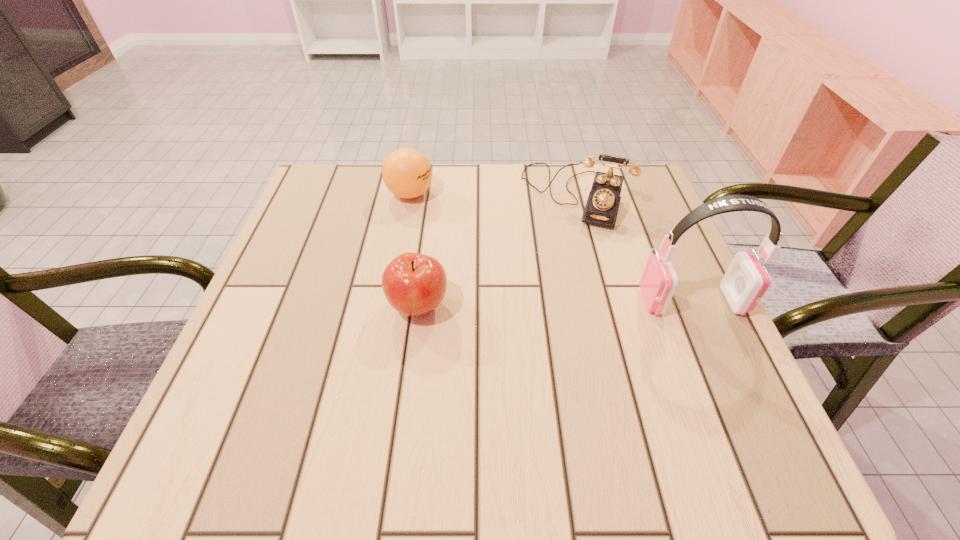
Locate an element on the screen. apple is located at coordinates (414, 284).

Locate an element on the screen. Image resolution: width=960 pixels, height=540 pixels. earphone is located at coordinates (745, 283).

I want to click on ping-pong ball, so click(407, 173).

At what (x,y) coordinates should I click in order to perform the action: click on telephone. Please return your answer as a coordinate pair (x, y). This screenshot has width=960, height=540. Looking at the image, I should click on (603, 202).

Identify the location of blank area located on the front of the apple. (410, 372).

Locate an element on the screen. The height and width of the screenshot is (540, 960). blank space located on the side with brand of the ping-pong ball is located at coordinates (506, 260).

Find the location of a particular element. This screenshot has width=960, height=540. free space located on the side with brand of the ping-pong ball is located at coordinates (484, 245).

This screenshot has width=960, height=540. Identify the location of vacant space located on the side with brand of the ping-pong ball. (499, 255).

Identify the location of vacant area located 0.150m on the dial of the telephone. The height and width of the screenshot is (540, 960). (550, 272).

Locate an element on the screen. This screenshot has height=540, width=960. free space located 0.260m on the dial of the telephone is located at coordinates (538, 310).